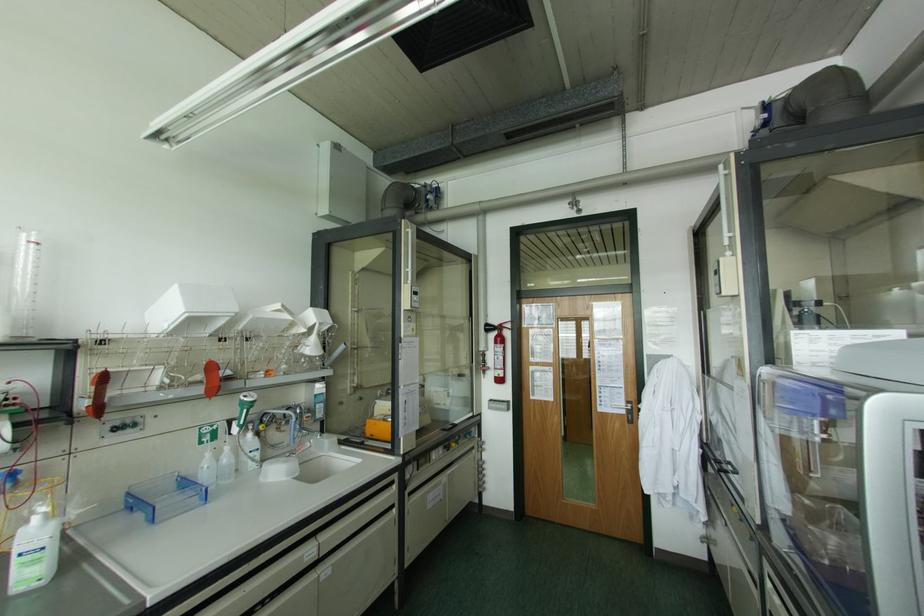
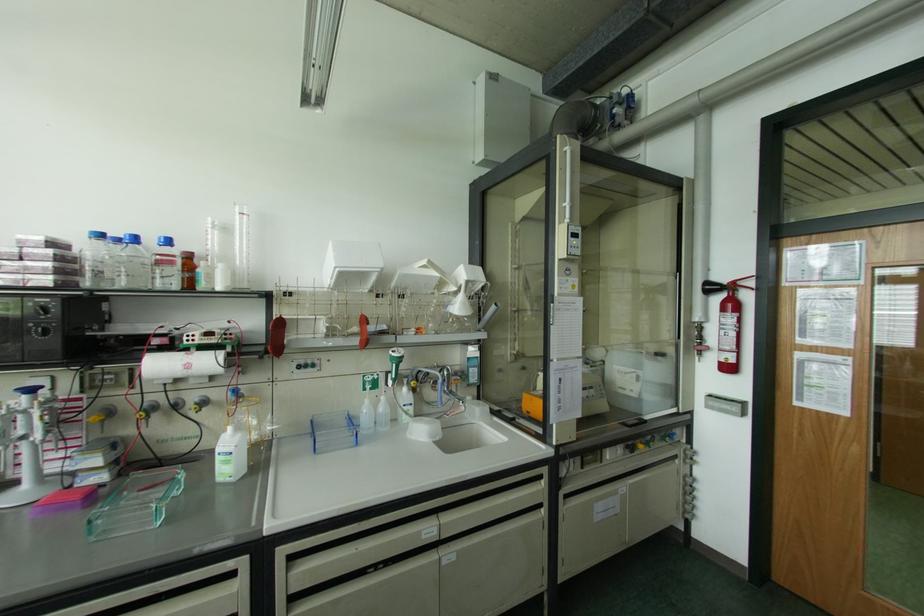
Find the pixel in the second image that matches point 208,454 in the first image.

(367, 400)